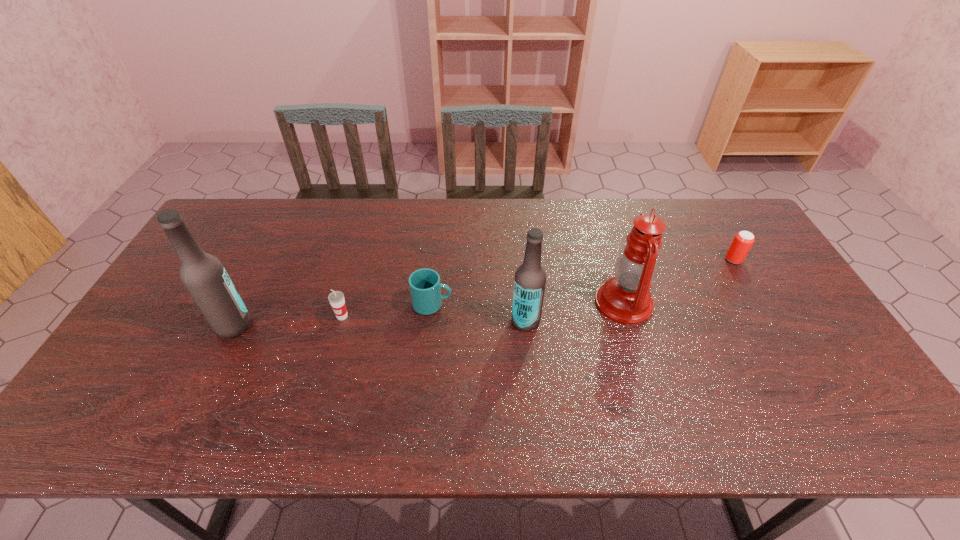
Find the location of a particular element. The image size is (960, 540). vacant point located 0.350m on the label of the third object from right to left is located at coordinates (383, 321).

Where is `free space located on the label of the third object from right to left`? This screenshot has height=540, width=960. free space located on the label of the third object from right to left is located at coordinates (435, 321).

The image size is (960, 540). I want to click on free point located 0.240m on the label of the third object from right to left, so click(423, 321).

Locate an element on the screen. vacant space located 0.050m on the left of the rightmost object is located at coordinates (709, 260).

What are the coordinates of `free spot located on the handle side of the right cup` in the screenshot? It's located at (522, 305).

This screenshot has width=960, height=540. In order to click on vacant position located 0.290m on the left of the second object from right to left in this screenshot , I will do `click(493, 302)`.

At what (x,y) coordinates should I click in order to perform the action: click on vacant space located on the side of the left cup with the logo. Please return your answer as a coordinate pair (x, y). Image resolution: width=960 pixels, height=540 pixels. Looking at the image, I should click on (326, 373).

You are a GUI agent. You are given a task and a screenshot of the screen. Output one action in this format:
    pyautogui.click(x=<x>, y=<y>)
    Task: Click on the object positioned at the right edge
    This screenshot has height=540, width=960.
    Given the screenshot: What is the action you would take?
    pyautogui.click(x=743, y=240)

Locate an element on the screen. The image size is (960, 540). free space at the far edge of the desktop is located at coordinates (678, 237).

The width and height of the screenshot is (960, 540). In the image, there is a desktop. In order to click on vacant space at the near edge in this screenshot , I will do `click(455, 371)`.